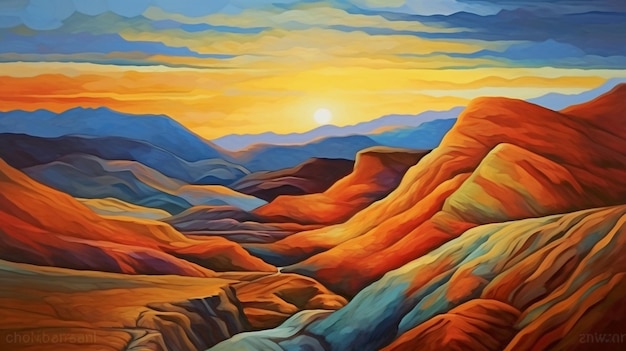
Identify the location of picture. The height and width of the screenshot is (351, 626). (399, 186).